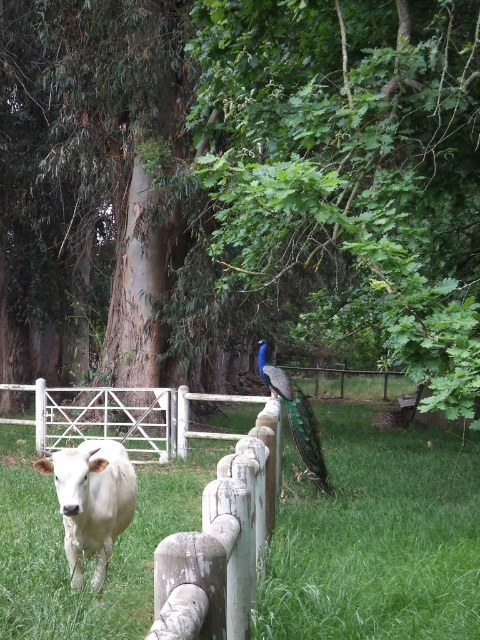
Question: Among these points, which one is nearest to the camera?

Choices:
 (A) (72, 515)
 (B) (300, 417)

Answer: (A)

Question: Which of the following is the farthest from the observer?

Choices:
 (A) (100, 540)
 (B) (263, 355)

Answer: (B)

Question: Is green leafy tree at center closer to camera compared to white glossy bull at center?

Choices:
 (A) no
 (B) yes

Answer: (B)

Question: Estimate the real-world distances between objects in this image. Which object is closer to the shiny blue peacock at center?

Choices:
 (A) green leafy tree at center
 (B) white glossy bull at center

Answer: (B)

Question: Is white glossy bull at center closer to the viewer compared to shiny blue peacock at center?

Choices:
 (A) yes
 (B) no

Answer: (A)

Question: Is white glossy bull at center positioned at the back of shiny blue peacock at center?

Choices:
 (A) no
 (B) yes

Answer: (A)